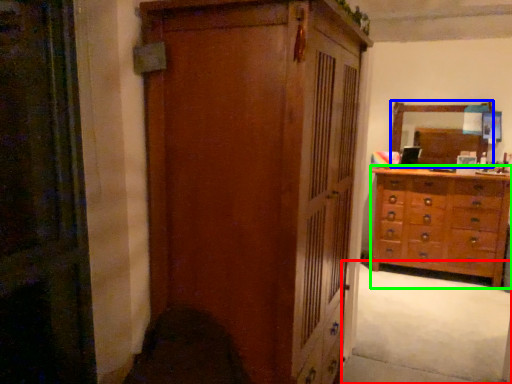
Question: Based on their relative distances, which object is nearer to plain (highlighted by a red box)? Choose from mirror (highlighted by a blue box) and chest of drawers (highlighted by a green box).

Choices:
 (A) mirror
 (B) chest of drawers

Answer: (B)